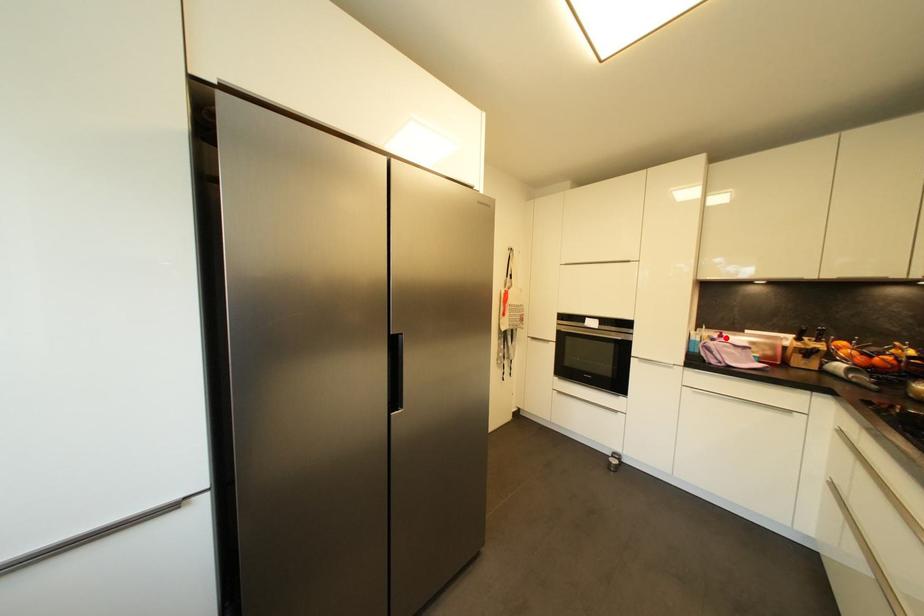
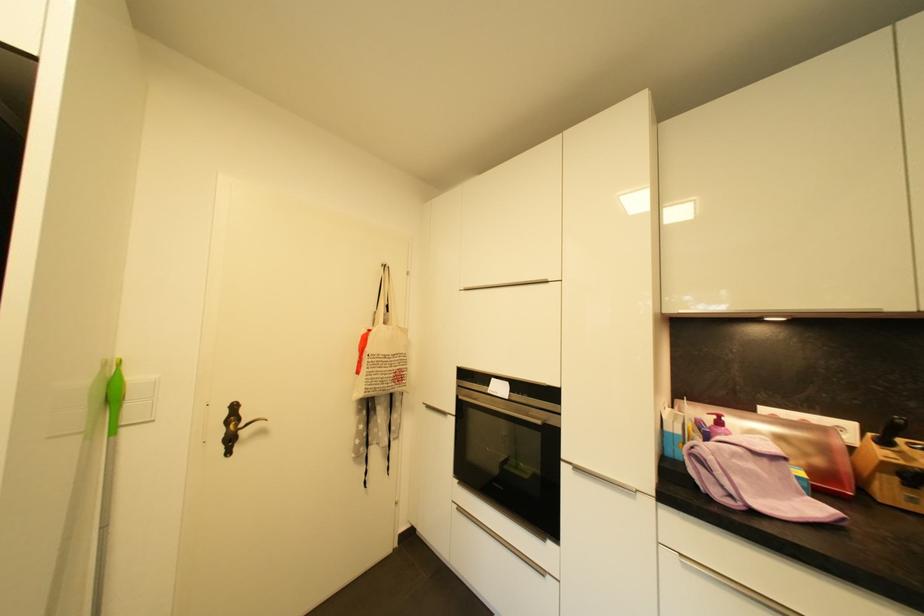
Find the pixel in the second image that matches the highlighted location in the first image.

(724, 424)